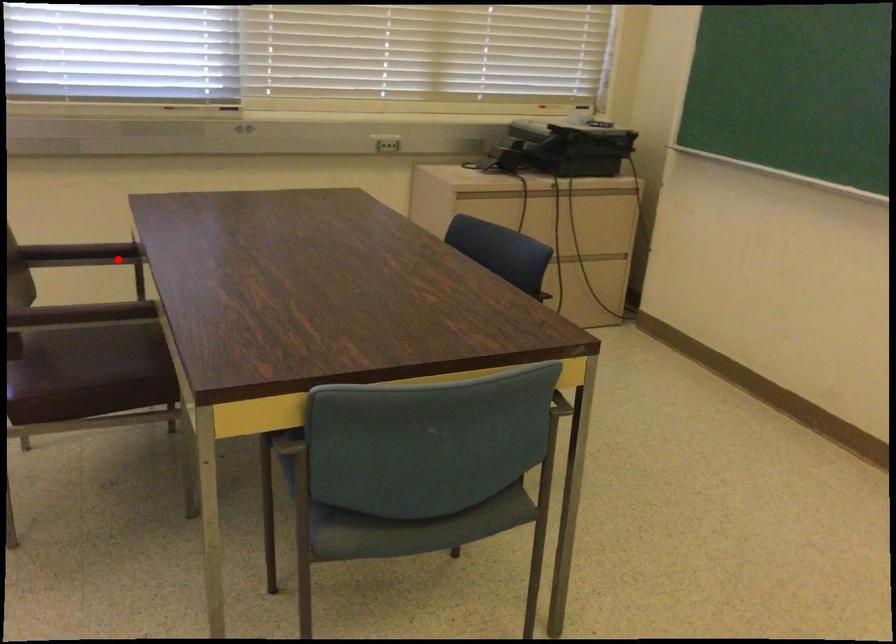
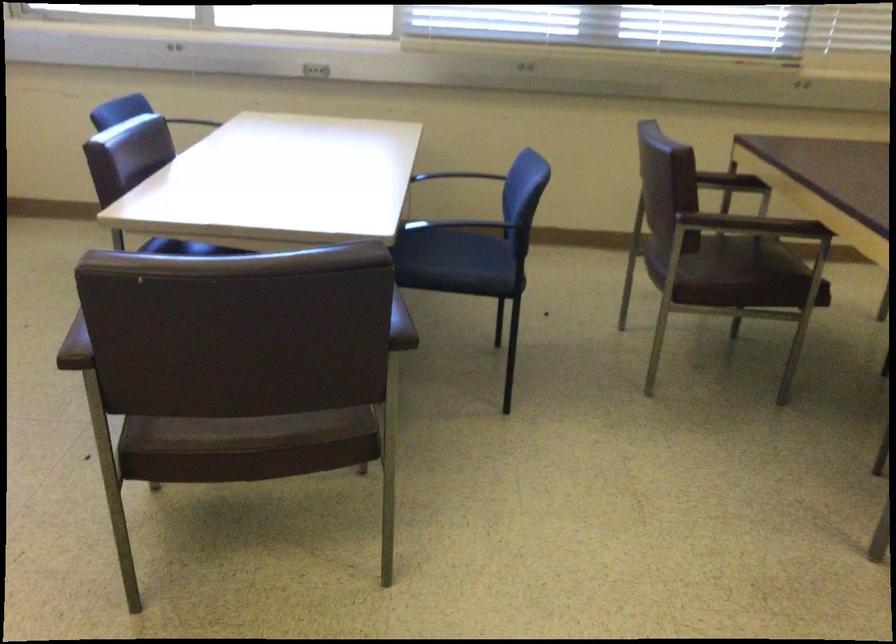
The point at the highlighted location is marked in the first image. Where is the corresponding point in the second image?

(730, 182)